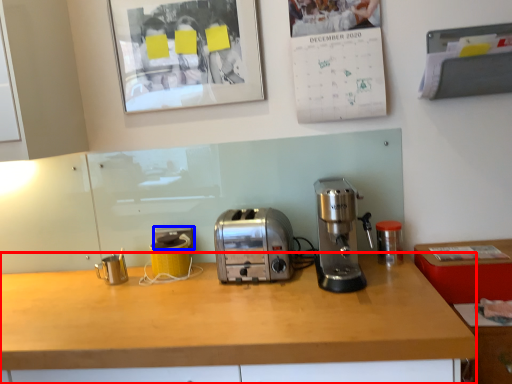
Question: Which object appears farthest to the camera in this image, desk (highlighted by a red box) or electric outlet (highlighted by a blue box)?

Choices:
 (A) desk
 (B) electric outlet

Answer: (B)